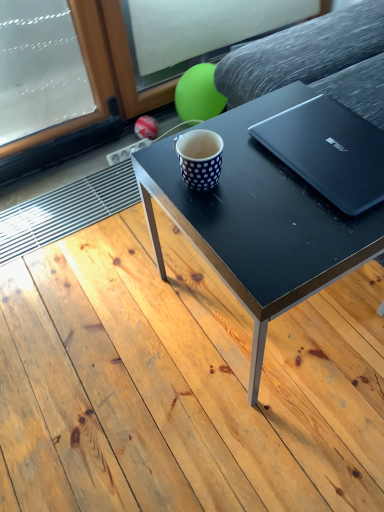
Find the location of a particular element. This screenshot has width=384, height=512. free space in front of white dotted mug at center is located at coordinates (232, 223).